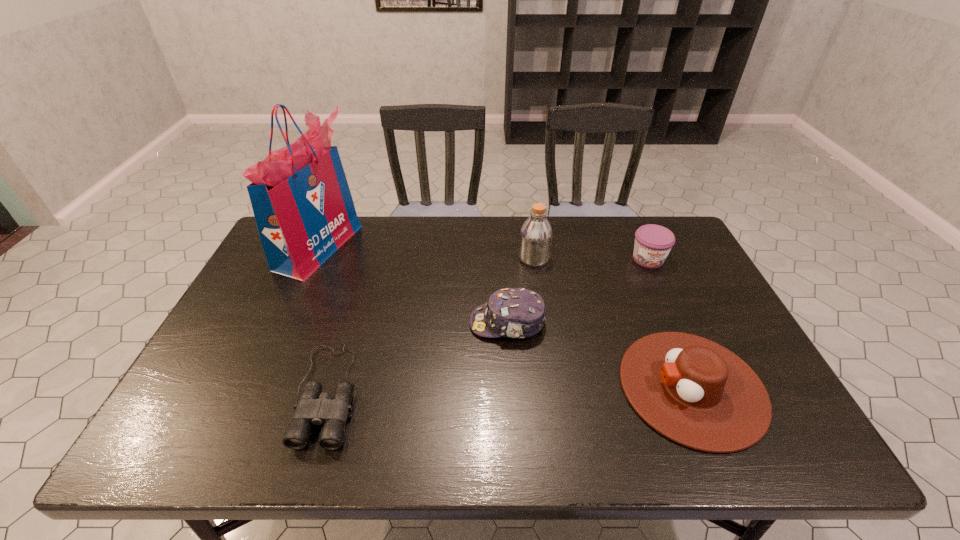
You are a GUI agent. You are given a task and a screenshot of the screen. Output one action in this format:
    pyautogui.click(x=<x>, y=<y>)
    Task: Click on the vacant space that satisfies the following two spatial constraints: 1. on the front-facing side of the grocery bag; 2. on the right side of the fifth shortest object
    The width and height of the screenshot is (960, 540).
    Given the screenshot: What is the action you would take?
    pyautogui.click(x=314, y=258)

At what (x,y) coordinates should I click in order to perform the action: click on vacant space that satisfies the following two spatial constraints: 1. on the front-facing side of the grocery bag; 2. on the back side of the fifth shortest object. Please return your answer as a coordinate pair (x, y). This screenshot has width=960, height=540. Looking at the image, I should click on (314, 258).

This screenshot has width=960, height=540. What are the coordinates of `vacant region that satisfies the following two spatial constraints: 1. on the front-facing side of the headwear; 2. at the eyepiece of the binoculars` in the screenshot? It's located at (512, 393).